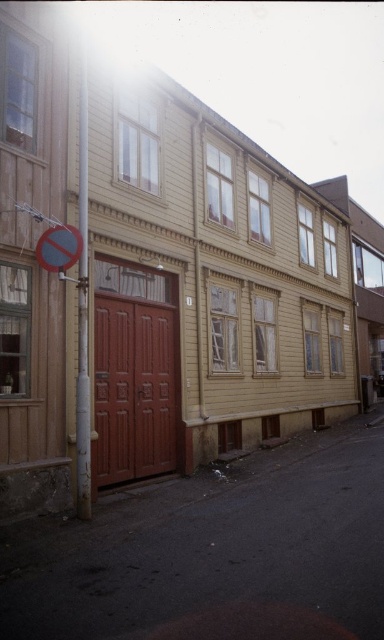
Does metallic silver pole at center lie in front of yellow plastic traffic sign at upper left?

Yes, it is.

Does metallic silver pole at center have a greater height compared to yellow plastic traffic sign at upper left?

Correct, metallic silver pole at center is much taller as yellow plastic traffic sign at upper left.

You are a GUI agent. You are given a task and a screenshot of the screen. Output one action in this format:
    pyautogui.click(x=<x>, y=<y>)
    Task: Click on the metallic silver pole at center
    The height and width of the screenshot is (640, 384).
    Given the screenshot: What is the action you would take?
    pyautogui.click(x=82, y=312)

Does point (301, 467) come behind point (56, 266)?

Yes, it is behind point (56, 266).

Where is `brown wooden alley at lower left`? The height and width of the screenshot is (640, 384). brown wooden alley at lower left is located at coordinates (211, 545).

The height and width of the screenshot is (640, 384). In order to click on brown wooden alley at lower left in this screenshot , I will do `click(211, 545)`.

This screenshot has height=640, width=384. I want to click on brown wooden alley at lower left, so click(211, 545).

Between brown wooden alley at lower left and metallic silver pole at center, which one is positioned higher?

metallic silver pole at center

Which is below, brown wooden alley at lower left or metallic silver pole at center?

brown wooden alley at lower left is below.

Image resolution: width=384 pixels, height=640 pixels. In order to click on brown wooden alley at lower left in this screenshot , I will do `click(211, 545)`.